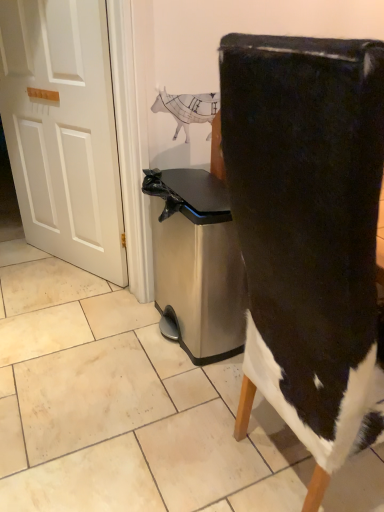
Question: Could you tell me if black suede chair at center is turned towards white matte door at left?

Choices:
 (A) no
 (B) yes

Answer: (A)

Question: From a real-world perspective, is black suede chair at center on white matte door at left?

Choices:
 (A) no
 (B) yes

Answer: (A)

Question: From the image's perspective, is black suede chair at center beneath white matte door at left?

Choices:
 (A) yes
 (B) no

Answer: (A)

Question: Considering the relative positions of black suede chair at center and white matte door at left in the image provided, is black suede chair at center to the left of white matte door at left from the viewer's perspective?

Choices:
 (A) no
 (B) yes

Answer: (A)

Question: Is black suede chair at center closer to camera compared to white matte door at left?

Choices:
 (A) no
 (B) yes

Answer: (B)

Question: Does black suede chair at center have a smaller size compared to white matte door at left?

Choices:
 (A) no
 (B) yes

Answer: (A)

Question: Does stainless steel trash can at center lie behind black suede chair at center?

Choices:
 (A) no
 (B) yes

Answer: (B)

Question: Is stainless steel trash can at center positioned in front of black suede chair at center?

Choices:
 (A) yes
 (B) no

Answer: (B)

Question: Is stainless steel trash can at center oriented away from black suede chair at center?

Choices:
 (A) yes
 (B) no

Answer: (B)

Question: Does stainless steel trash can at center have a larger size compared to black suede chair at center?

Choices:
 (A) yes
 (B) no

Answer: (B)

Question: From the image's perspective, is stainless steel trash can at center on top of black suede chair at center?

Choices:
 (A) no
 (B) yes

Answer: (B)

Question: Are stainless steel trash can at center and black suede chair at center located far from each other?

Choices:
 (A) no
 (B) yes

Answer: (A)

Question: From a real-world perspective, is white matte door at left physically above black suede chair at center?

Choices:
 (A) no
 (B) yes

Answer: (B)